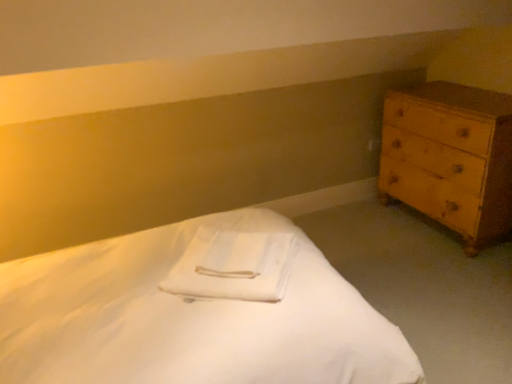
Where is `light brown wooden chest of drawers at right`? The image size is (512, 384). light brown wooden chest of drawers at right is located at coordinates (450, 157).

What do you see at coordinates (195, 311) in the screenshot?
I see `white smooth bed at center` at bounding box center [195, 311].

Find the location of a particular element. This screenshot has height=384, width=512. white soft towel at center is located at coordinates (233, 266).

The height and width of the screenshot is (384, 512). I want to click on light brown wooden chest of drawers at right, so pos(450,157).

Considering the relative sizes of white smooth bed at center and light brown wooden chest of drawers at right in the image provided, is white smooth bed at center wider than light brown wooden chest of drawers at right?

Correct, the width of white smooth bed at center exceeds that of light brown wooden chest of drawers at right.

From the image's perspective, is white smooth bed at center over light brown wooden chest of drawers at right?

No.

Is white smooth bed at center oriented away from light brown wooden chest of drawers at right?

No, white smooth bed at center is not facing the opposite direction of light brown wooden chest of drawers at right.

Looking at this image, who is smaller, white smooth bed at center or light brown wooden chest of drawers at right?

With smaller size is light brown wooden chest of drawers at right.

From the image's perspective, between light brown wooden chest of drawers at right and white smooth bed at center, who is located below?

white smooth bed at center.

From a real-world perspective, between light brown wooden chest of drawers at right and white smooth bed at center, who is vertically higher?

From a 3D spatial view, light brown wooden chest of drawers at right is above.

Which of these two, light brown wooden chest of drawers at right or white smooth bed at center, stands shorter?

Standing shorter between the two is white smooth bed at center.

Is light brown wooden chest of drawers at right turned away from white smooth bed at center?

No, light brown wooden chest of drawers at right's orientation is not away from white smooth bed at center.

Are white soft towel at center and white smooth bed at center making contact?

No, white soft towel at center is not touching white smooth bed at center.

Which of these two, white soft towel at center or white smooth bed at center, stands shorter?

white soft towel at center.

Consider the image. Is white soft towel at center positioned with its back to white smooth bed at center?

Yes, white soft towel at center is positioned with its back facing white smooth bed at center.

Between light brown wooden chest of drawers at right and white soft towel at center, which one appears on the right side from the viewer's perspective?

light brown wooden chest of drawers at right.

From a real-world perspective, is light brown wooden chest of drawers at right below white soft towel at center?

Yes.

How many degrees apart are the facing directions of light brown wooden chest of drawers at right and white soft towel at center?

The angle between the facing direction of light brown wooden chest of drawers at right and the facing direction of white soft towel at center is 142 degrees.

From the image's perspective, is light brown wooden chest of drawers at right beneath white soft towel at center?

No.

Based on the photo, which is more to the left, white smooth bed at center or white soft towel at center?

white smooth bed at center is more to the left.

Is white smooth bed at center beside white soft towel at center?

They are not placed beside each other.

Which of these two, white smooth bed at center or white soft towel at center, is smaller?

Smaller between the two is white soft towel at center.

In the scene shown: Considering their positions, is white soft towel at center located in front of or behind light brown wooden chest of drawers at right?

white soft towel at center is positioned closer to the viewer than light brown wooden chest of drawers at right.

Which is more to the right, white soft towel at center or light brown wooden chest of drawers at right?

light brown wooden chest of drawers at right is more to the right.

How far apart are white soft towel at center and light brown wooden chest of drawers at right?

white soft towel at center is 4.61 feet from light brown wooden chest of drawers at right.

Is white soft towel at center shorter than light brown wooden chest of drawers at right?

Indeed, white soft towel at center has a lesser height compared to light brown wooden chest of drawers at right.

Where is `bed below the light brown wooden chest of drawers at right (from a real-world perspective)`? bed below the light brown wooden chest of drawers at right (from a real-world perspective) is located at coordinates (195, 311).

Locate an element on the screen. The width and height of the screenshot is (512, 384). bed in front of the light brown wooden chest of drawers at right is located at coordinates (195, 311).

Which object lies further to the anchor point light brown wooden chest of drawers at right, white smooth bed at center or white soft towel at center?

The object further to light brown wooden chest of drawers at right is white smooth bed at center.

Looking at the image, which one is located closer to light brown wooden chest of drawers at right, white soft towel at center or white smooth bed at center?

white soft towel at center lies closer to light brown wooden chest of drawers at right than the other object.

In the scene shown: From the image, which object appears to be farther from white smooth bed at center, white soft towel at center or light brown wooden chest of drawers at right?

The object further to white smooth bed at center is light brown wooden chest of drawers at right.

Considering their positions, is white smooth bed at center positioned further to white soft towel at center than light brown wooden chest of drawers at right?

The object further to white soft towel at center is light brown wooden chest of drawers at right.

Estimate the real-world distances between objects in this image. Which object is closer to white smooth bed at center, light brown wooden chest of drawers at right or white soft towel at center?

white soft towel at center.

Based on their spatial positions, is light brown wooden chest of drawers at right or white smooth bed at center closer to white soft towel at center?

Based on the image, white smooth bed at center appears to be nearer to white soft towel at center.

Identify the location of cloth between white smooth bed at center and light brown wooden chest of drawers at right. pos(233,266).